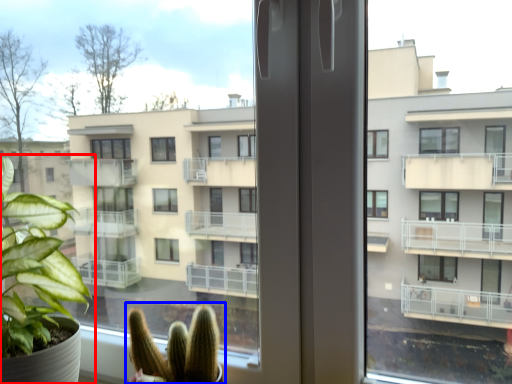
Question: Which object appears closest to the camera in this image, houseplant (highlighted by a red box) or houseplant (highlighted by a blue box)?

Choices:
 (A) houseplant
 (B) houseplant

Answer: (A)